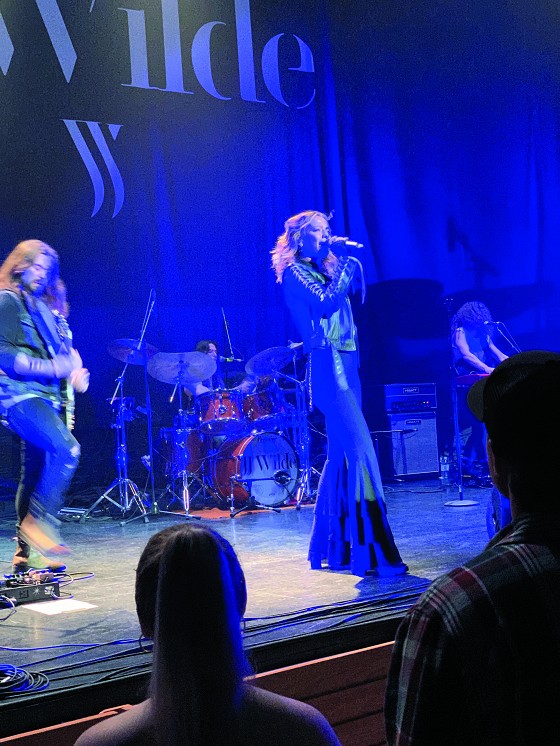
Identify the location of curtain. (268, 175).